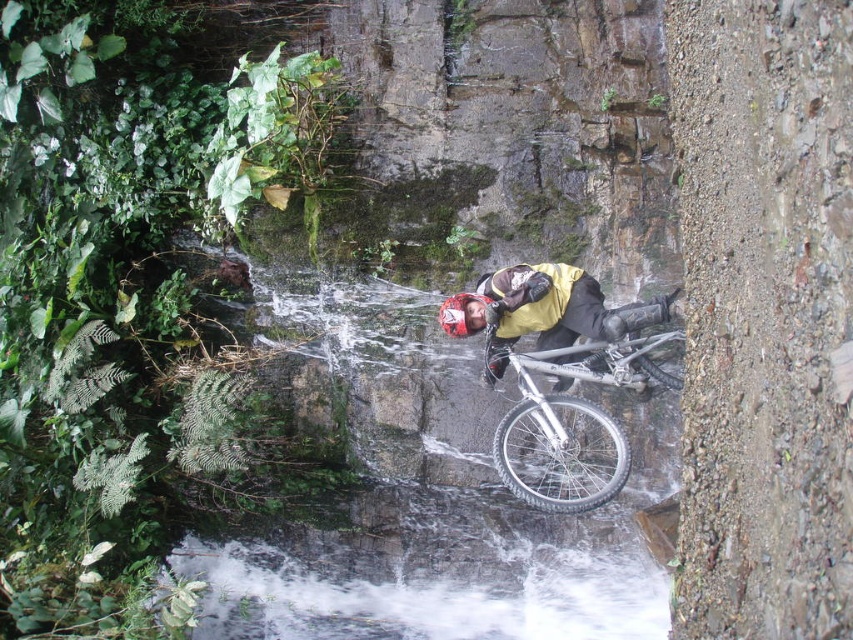
Which is below, silver metallic mountain bike at center or yellow matte jacket at center?

silver metallic mountain bike at center is below.

In the scene shown: Can you confirm if silver metallic mountain bike at center is thinner than yellow matte jacket at center?

Yes, silver metallic mountain bike at center is thinner than yellow matte jacket at center.

You are a GUI agent. You are given a task and a screenshot of the screen. Output one action in this format:
    pyautogui.click(x=<x>, y=<y>)
    Task: Click on the silver metallic mountain bike at center
    Image resolution: width=853 pixels, height=640 pixels.
    Given the screenshot: What is the action you would take?
    pyautogui.click(x=573, y=410)